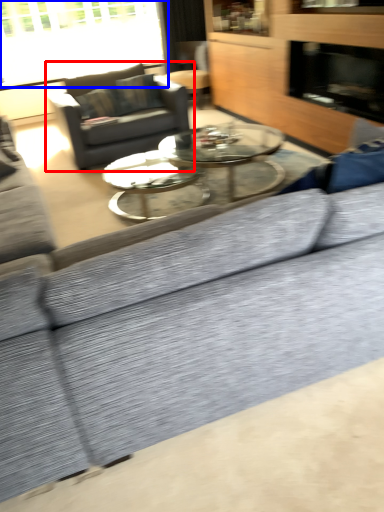
Question: Which object appears farthest to the camera in this image, studio couch (highlighted by a red box) or window (highlighted by a blue box)?

Choices:
 (A) studio couch
 (B) window

Answer: (B)